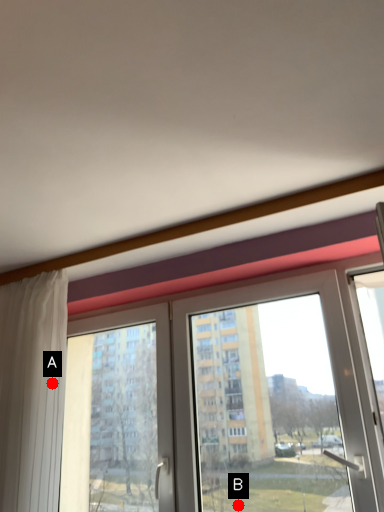
Question: Two points are circled on the image, labeled by A and B beside each circle. Which point is farther from the camera taking this photo?

Choices:
 (A) A is further
 (B) B is further

Answer: (B)